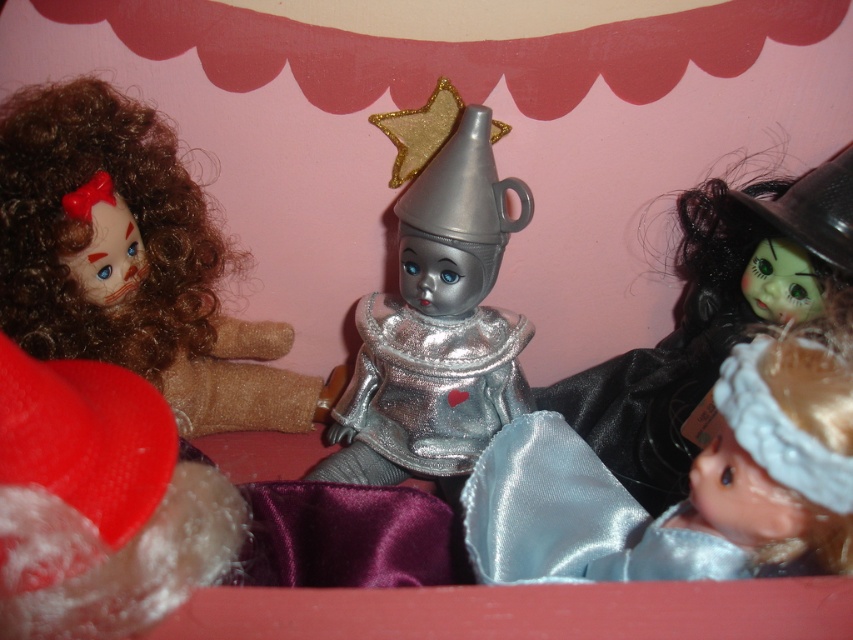
Who is shorter, matte brown doll at left or satin blue dress at lower right?

satin blue dress at lower right is shorter.

Who is more forward, [184,346] or [621,568]?

Point [621,568] is in front.

Describe the element at coordinates (131, 260) in the screenshot. I see `matte brown doll at left` at that location.

I want to click on matte brown doll at left, so click(131, 260).

Is matte brown doll at left to the left of metallic silver tin at center from the viewer's perspective?

Indeed, matte brown doll at left is positioned on the left side of metallic silver tin at center.

The image size is (853, 640). What do you see at coordinates (131, 260) in the screenshot?
I see `matte brown doll at left` at bounding box center [131, 260].

Is point (96, 292) farther from viewer compared to point (434, 320)?

No.

At what (x,y) coordinates should I click in order to perform the action: click on matte brown doll at left. Please return your answer as a coordinate pair (x, y). This screenshot has width=853, height=640. Looking at the image, I should click on (131, 260).

Between point (30, 156) and point (738, 301), which one is positioned in front?

Point (30, 156)

Can you confirm if matte brown doll at left is taller than shiny black witch hat at right?

Incorrect, matte brown doll at left's height is not larger of shiny black witch hat at right's.

Is point (181, 280) positioned behind point (730, 346)?

Yes, it is behind point (730, 346).

Locate an element on the screen. This screenshot has height=640, width=853. matte brown doll at left is located at coordinates (131, 260).